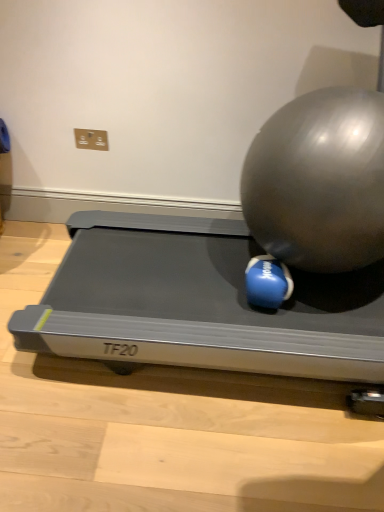
The height and width of the screenshot is (512, 384). What do you see at coordinates (199, 303) in the screenshot?
I see `silver metallic treadmill at center` at bounding box center [199, 303].

Identify the location of blue rubber ball at center, marked as the 1th ball in a left-to-right arrangement. (267, 282).

Is silver metallic treadmill at center surrounding shiny metallic ball at center right, arranged as the second ball when viewed from the left?

No, shiny metallic ball at center right, arranged as the second ball when viewed from the left, is not a part of silver metallic treadmill at center.

What's the angular difference between silver metallic treadmill at center and shiny metallic ball at center right, arranged as the second ball when viewed from the left,'s facing directions?

89.6 degrees.

Is silver metallic treadmill at center to the right of shiny metallic ball at center right, which is counted as the 1th ball, starting from the right, from the viewer's perspective?

Incorrect, silver metallic treadmill at center is not on the right side of shiny metallic ball at center right, which is counted as the 1th ball, starting from the right.

From the image's perspective, is silver metallic treadmill at center under shiny metallic ball at center right, arranged as the second ball when viewed from the left?

Yes.

Between blue rubber ball at center, marked as the 1th ball in a left-to-right arrangement, and shiny metallic ball at center right, which is counted as the 1th ball, starting from the right, which one appears on the right side from the viewer's perspective?

Positioned to the right is shiny metallic ball at center right, which is counted as the 1th ball, starting from the right.

From the picture: Is blue rubber ball at center, marked as the 1th ball in a left-to-right arrangement, inside or outside of shiny metallic ball at center right, which is counted as the 1th ball, starting from the right?

blue rubber ball at center, marked as the 1th ball in a left-to-right arrangement, is inside shiny metallic ball at center right, which is counted as the 1th ball, starting from the right.

From a real-world perspective, is blue rubber ball at center, marked as the 1th ball in a left-to-right arrangement, below shiny metallic ball at center right, arranged as the second ball when viewed from the left?

Indeed, from a real-world perspective, blue rubber ball at center, marked as the 1th ball in a left-to-right arrangement, is positioned beneath shiny metallic ball at center right, arranged as the second ball when viewed from the left.

Which object is more forward, blue rubber ball at center, positioned as the second ball in right-to-left order, or shiny metallic ball at center right, which is counted as the 1th ball, starting from the right?

shiny metallic ball at center right, which is counted as the 1th ball, starting from the right, is more forward.

Identify the location of ball behind the silver metallic treadmill at center. This screenshot has height=512, width=384. (267, 282).

Which of these two, blue rubber ball at center, marked as the 1th ball in a left-to-right arrangement, or silver metallic treadmill at center, stands taller?

With more height is blue rubber ball at center, marked as the 1th ball in a left-to-right arrangement.

Is blue rubber ball at center, positioned as the second ball in right-to-left order, positioned with its back to silver metallic treadmill at center?

No.

Based on their sizes in the image, would you say silver metallic treadmill at center is bigger or smaller than blue rubber ball at center, positioned as the second ball in right-to-left order?

Clearly, silver metallic treadmill at center is larger in size than blue rubber ball at center, positioned as the second ball in right-to-left order.

Does point (170, 330) appear closer or farther from the camera than point (250, 280)?

Point (170, 330).

Is silver metallic treadmill at center inside or outside of blue rubber ball at center, positioned as the second ball in right-to-left order?

silver metallic treadmill at center lies outside blue rubber ball at center, positioned as the second ball in right-to-left order.

Looking at this image, could you tell me if silver metallic treadmill at center is facing blue rubber ball at center, marked as the 1th ball in a left-to-right arrangement?

No.

Is shiny metallic ball at center right, arranged as the second ball when viewed from the left, positioned far away from blue rubber ball at center, marked as the 1th ball in a left-to-right arrangement?

shiny metallic ball at center right, arranged as the second ball when viewed from the left, is actually quite close to blue rubber ball at center, marked as the 1th ball in a left-to-right arrangement.

Do you think shiny metallic ball at center right, which is counted as the 1th ball, starting from the right, is within blue rubber ball at center, marked as the 1th ball in a left-to-right arrangement, or outside of it?

shiny metallic ball at center right, which is counted as the 1th ball, starting from the right, is spatially situated outside blue rubber ball at center, marked as the 1th ball in a left-to-right arrangement.

Which object is positioned more to the left, shiny metallic ball at center right, which is counted as the 1th ball, starting from the right, or blue rubber ball at center, marked as the 1th ball in a left-to-right arrangement?

blue rubber ball at center, marked as the 1th ball in a left-to-right arrangement.

Can you tell me how much shiny metallic ball at center right, which is counted as the 1th ball, starting from the right, and blue rubber ball at center, positioned as the second ball in right-to-left order, differ in facing direction?

6.78e-05 degrees.

From a real-world perspective, does shiny metallic ball at center right, which is counted as the 1th ball, starting from the right, sit lower than silver metallic treadmill at center?

No, from a real-world perspective, shiny metallic ball at center right, which is counted as the 1th ball, starting from the right, is not under silver metallic treadmill at center.

Is shiny metallic ball at center right, arranged as the second ball when viewed from the left, to the left of silver metallic treadmill at center from the viewer's perspective?

In fact, shiny metallic ball at center right, arranged as the second ball when viewed from the left, is to the right of silver metallic treadmill at center.

Considering the positions of point (371, 105) and point (193, 336), is point (371, 105) closer or farther from the camera than point (193, 336)?

Clearly, point (371, 105) is closer to the camera than point (193, 336).

Can you tell me how much shiny metallic ball at center right, arranged as the second ball when viewed from the left, and silver metallic treadmill at center differ in facing direction?

The angular difference between shiny metallic ball at center right, arranged as the second ball when viewed from the left, and silver metallic treadmill at center is 89.6 degrees.

Which ball is the 2nd one when counting from the right side of the silver metallic treadmill at center? Please provide its 2D coordinates.

[(319, 181)]

Where is `ball below the shiny metallic ball at center right, arranged as the second ball when viewed from the left (from the image's perspective)`? ball below the shiny metallic ball at center right, arranged as the second ball when viewed from the left (from the image's perspective) is located at coordinates (267, 282).

Estimate the real-world distances between objects in this image. Which object is further from silver metallic treadmill at center, shiny metallic ball at center right, arranged as the second ball when viewed from the left, or blue rubber ball at center, positioned as the second ball in right-to-left order?

Based on the image, shiny metallic ball at center right, arranged as the second ball when viewed from the left, appears to be further to silver metallic treadmill at center.

Based on their spatial positions, is blue rubber ball at center, positioned as the second ball in right-to-left order, or shiny metallic ball at center right, which is counted as the 1th ball, starting from the right, further from silver metallic treadmill at center?

Based on the image, shiny metallic ball at center right, which is counted as the 1th ball, starting from the right, appears to be further to silver metallic treadmill at center.

Based on the photo, estimate the real-world distances between objects in this image. Which object is closer to shiny metallic ball at center right, arranged as the second ball when viewed from the left, silver metallic treadmill at center or blue rubber ball at center, marked as the 1th ball in a left-to-right arrangement?

blue rubber ball at center, marked as the 1th ball in a left-to-right arrangement, is positioned closer to the anchor shiny metallic ball at center right, arranged as the second ball when viewed from the left.

Estimate the real-world distances between objects in this image. Which object is closer to blue rubber ball at center, marked as the 1th ball in a left-to-right arrangement, shiny metallic ball at center right, which is counted as the 1th ball, starting from the right, or silver metallic treadmill at center?

Based on the image, shiny metallic ball at center right, which is counted as the 1th ball, starting from the right, appears to be nearer to blue rubber ball at center, marked as the 1th ball in a left-to-right arrangement.

Based on their spatial positions, is blue rubber ball at center, positioned as the second ball in right-to-left order, or silver metallic treadmill at center closer to shiny metallic ball at center right, which is counted as the 1th ball, starting from the right?

blue rubber ball at center, positioned as the second ball in right-to-left order, is closer to shiny metallic ball at center right, which is counted as the 1th ball, starting from the right.

When comparing their distances from blue rubber ball at center, positioned as the second ball in right-to-left order, does silver metallic treadmill at center or shiny metallic ball at center right, arranged as the second ball when viewed from the left, seem closer?

shiny metallic ball at center right, arranged as the second ball when viewed from the left.

I want to click on ball between silver metallic treadmill at center and shiny metallic ball at center right, which is counted as the 1th ball, starting from the right, so click(267, 282).